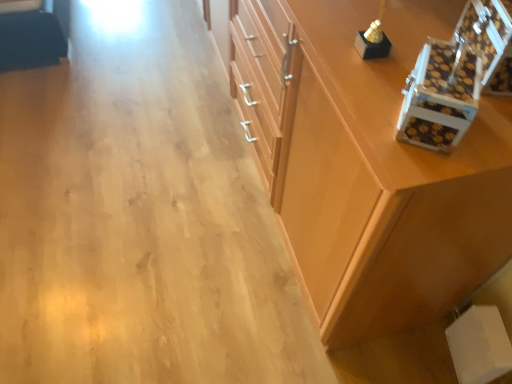
You are a GUI agent. You are given a task and a screenshot of the screen. Output one action in this format:
    pyautogui.click(x=<x>, y=<y>)
    Task: Click on the unoccupied space behind white textured box at upper right, marked as the 1th box in a left-to-right arrangement
    The height and width of the screenshot is (384, 512).
    Given the screenshot: What is the action you would take?
    pyautogui.click(x=381, y=61)